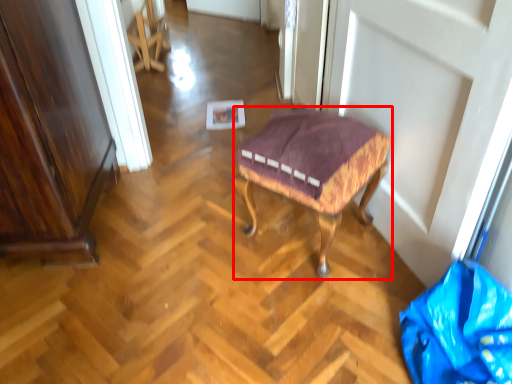
Question: From the image's perspective, where is stool (annotated by the red box) located in relation to material in the image?

Choices:
 (A) below
 (B) above

Answer: (B)